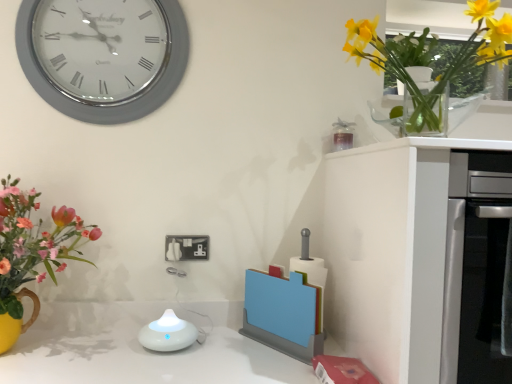
Question: Is point (142, 8) positioned closer to the camera than point (145, 344)?

Choices:
 (A) closer
 (B) farther

Answer: (B)

Question: From their relative heights in the image, would you say silver metallic clock at upper left is taller or shorter than white glossy diffuser at center?

Choices:
 (A) short
 (B) tall

Answer: (B)

Question: Considering the real-world distances, which object is closest to the silver metallic clock at upper left?

Choices:
 (A) yellow glass vase at upper right
 (B) white glossy diffuser at center
 (C) white matte cabinet at right
 (D) white plastic electrical outlet at center

Answer: (D)

Question: Considering the real-world distances, which object is closest to the silver metallic clock at upper left?

Choices:
 (A) white plastic electrical outlet at center
 (B) yellow glass vase at upper right
 (C) white matte cabinet at right
 (D) white glossy diffuser at center

Answer: (A)